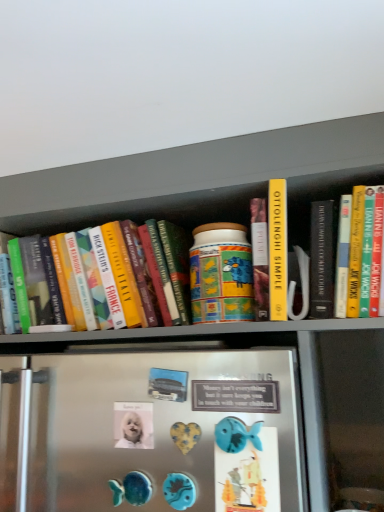
Question: Considering the relative sizes of blue plastic fish at lower center, placed as the 1th button when sorted from right to left, and white glossy button at center, which ranks as the second button in right-to-left order, in the image provided, is blue plastic fish at lower center, placed as the 1th button when sorted from right to left, thinner than white glossy button at center, which ranks as the second button in right-to-left order,?

Choices:
 (A) yes
 (B) no

Answer: (A)

Question: From a real-world perspective, is blue plastic fish at lower center, placed as the 1th button when sorted from right to left, positioned over white glossy button at center, arranged as the 2th button when viewed from the front, based on gravity?

Choices:
 (A) yes
 (B) no

Answer: (B)

Question: Can you confirm if blue plastic fish at lower center, which is the second button in back-to-front order, is smaller than white glossy button at center, placed as the 1th button when sorted from back to front?

Choices:
 (A) yes
 (B) no

Answer: (B)

Question: Does blue plastic fish at lower center, which is the second button in back-to-front order, have a larger size compared to white glossy button at center, which ranks as the second button in right-to-left order?

Choices:
 (A) no
 (B) yes

Answer: (B)

Question: Is blue plastic fish at lower center, the 2th button when ordered from left to right, completely or partially outside of white glossy button at center, arranged as the 2th button when viewed from the front?

Choices:
 (A) yes
 (B) no

Answer: (A)

Question: From the image's perspective, is white glossy button at center, arranged as the 2th button when viewed from the front, above or below blue plastic fish at lower center, the 2th button when ordered from left to right?

Choices:
 (A) below
 (B) above

Answer: (B)

Question: Would you say white glossy button at center, which ranks as the first button in left-to-right order, is inside or outside blue plastic fish at lower center, placed as the 1th button when sorted from right to left?

Choices:
 (A) inside
 (B) outside

Answer: (B)

Question: Based on their positions, is white glossy button at center, which ranks as the second button in right-to-left order, located to the left or right of blue plastic fish at lower center, which is the second button in back-to-front order?

Choices:
 (A) left
 (B) right

Answer: (A)

Question: Does point (137, 415) appear closer or farther from the camera than point (216, 481)?

Choices:
 (A) farther
 (B) closer

Answer: (A)

Question: Is hardcover book at left wider or thinner than white glossy button at center, arranged as the 2th button when viewed from the front?

Choices:
 (A) thin
 (B) wide

Answer: (B)

Question: From a real-world perspective, relative to white glossy button at center, arranged as the 2th button when viewed from the front, is hardcover book at left vertically above or below?

Choices:
 (A) below
 (B) above

Answer: (B)

Question: From the image's perspective, is hardcover book at left positioned above or below white glossy button at center, arranged as the 2th button when viewed from the front?

Choices:
 (A) above
 (B) below

Answer: (A)

Question: Relative to white glossy button at center, placed as the 1th button when sorted from back to front, is hardcover book at left in front or behind?

Choices:
 (A) behind
 (B) front

Answer: (A)

Question: In terms of height, does blue plastic fish at lower center, the 2th button when ordered from left to right, look taller or shorter compared to hardcover book at left?

Choices:
 (A) tall
 (B) short

Answer: (B)

Question: Is blue plastic fish at lower center, which is the second button in back-to-front order, wider or thinner than hardcover book at left?

Choices:
 (A) thin
 (B) wide

Answer: (A)